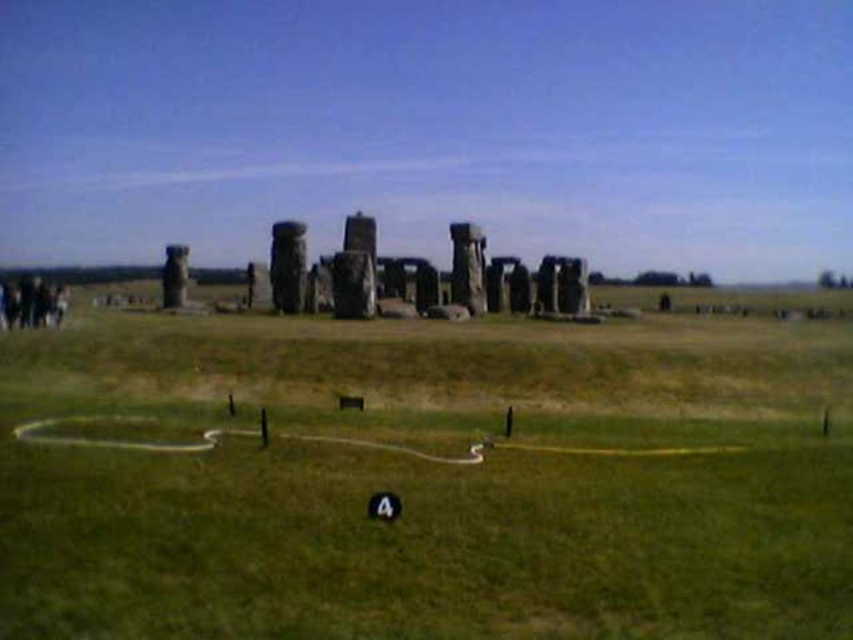
Measure the distance between dark brown hair at lower left and camera.

dark brown hair at lower left is 134.01 meters away from camera.

Can you confirm if dark brown hair at lower left is thinner than smooth gray stone monument at left?

Incorrect, dark brown hair at lower left's width is not less than smooth gray stone monument at left's.

Between point (36, 304) and point (171, 257), which one is positioned behind?

Positioned behind is point (171, 257).

Find the location of a particular element. dark brown hair at lower left is located at coordinates (33, 301).

Is point (392, 550) farther from viewer compared to point (183, 257)?

No, (392, 550) is in front of (183, 257).

Measure the distance from green grassy field at center to smooth gray stone monument at left.

80.17 meters

Image resolution: width=853 pixels, height=640 pixels. Find the location of `green grassy field at center`. green grassy field at center is located at coordinates (428, 480).

Identify the location of green grassy field at center. This screenshot has width=853, height=640. (428, 480).

Is green grassy field at center bigger than dark brown hair at lower left?

Indeed, green grassy field at center has a larger size compared to dark brown hair at lower left.

Can you confirm if green grassy field at center is wider than dark brown hair at lower left?

Indeed, green grassy field at center has a greater width compared to dark brown hair at lower left.

Describe the element at coordinates (428, 480) in the screenshot. I see `green grassy field at center` at that location.

Locate an element on the screen. Image resolution: width=853 pixels, height=640 pixels. green grassy field at center is located at coordinates (428, 480).